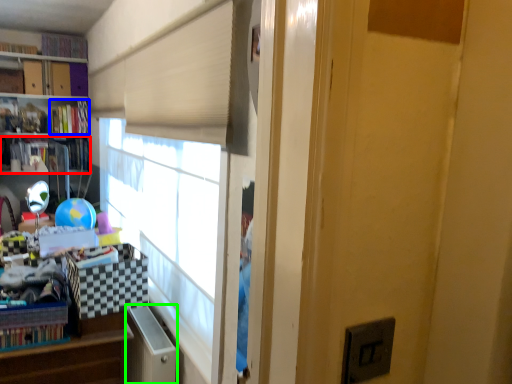
Question: Considering the real-world distances, which object is closest to book (highlighted by a red box)? book (highlighted by a blue box) or file cabinet (highlighted by a green box).

Choices:
 (A) book
 (B) file cabinet

Answer: (A)